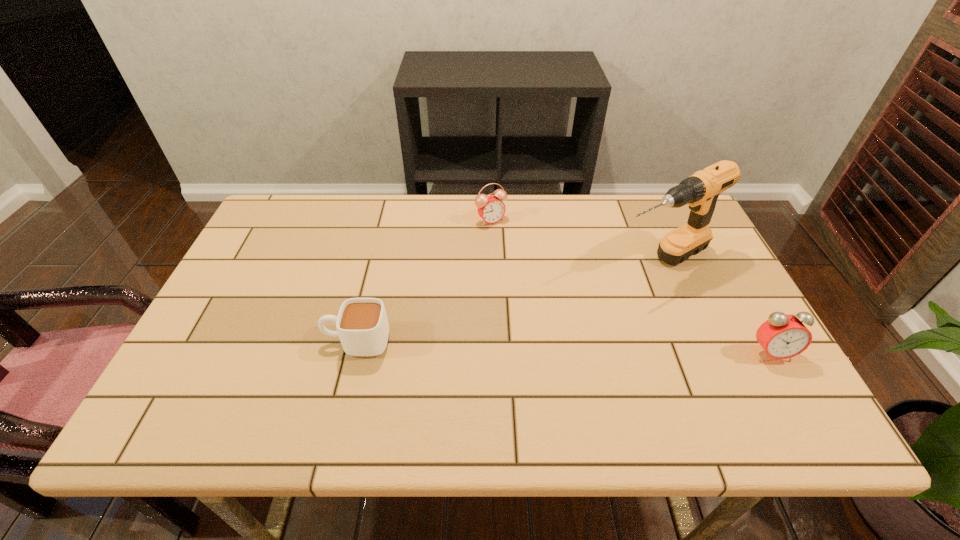
Identify the location of vacant spot on the desktop that is between the cup and the right alarm clock and is positioned on the clock face of the farther alarm clock. This screenshot has height=540, width=960. click(x=591, y=348).

Image resolution: width=960 pixels, height=540 pixels. I want to click on free space on the desktop that is between the leftmost object and the nearer alarm clock and is positioned at the tip of the second farthest object, so click(504, 346).